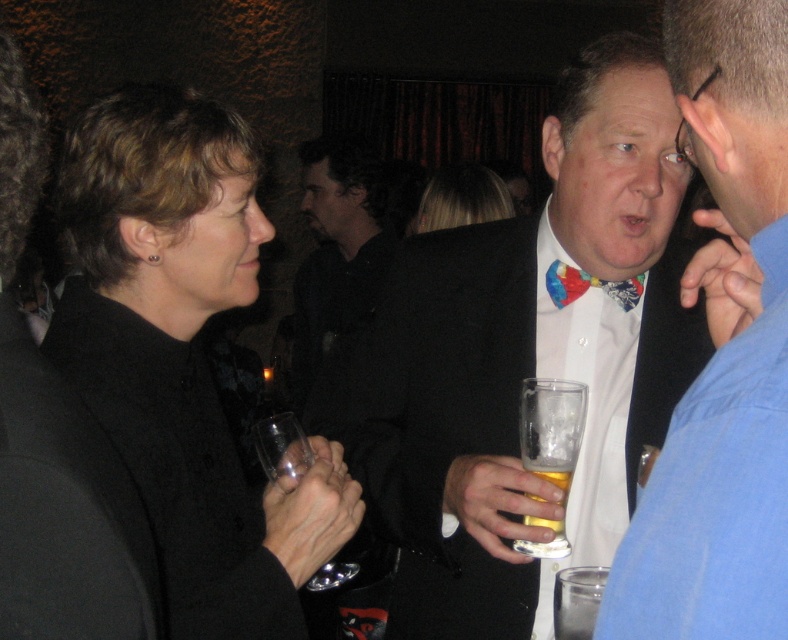
Question: Which point is closer to the camera?

Choices:
 (A) (87, 520)
 (B) (545, 472)
 (C) (601, 45)

Answer: (A)

Question: Does white glossy bow tie at center appear under matte black coat at left?

Choices:
 (A) no
 (B) yes

Answer: (B)

Question: Which point is closer to the camera taking this photo?

Choices:
 (A) (723, 624)
 (B) (206, 193)

Answer: (A)

Question: Estimate the real-world distances between objects in this image. Which object is farther from the matte black coat at left?

Choices:
 (A) white shirt with bow tie at center
 (B) clear glass beer at center
 (C) translucent glass beer at center

Answer: (C)

Question: Is matte black coat at left to the left of translucent glass beer at center from the viewer's perspective?

Choices:
 (A) yes
 (B) no

Answer: (A)

Question: Observing the image, what is the correct spatial positioning of matte black coat at left in reference to clear glass beer at center?

Choices:
 (A) below
 (B) above

Answer: (B)